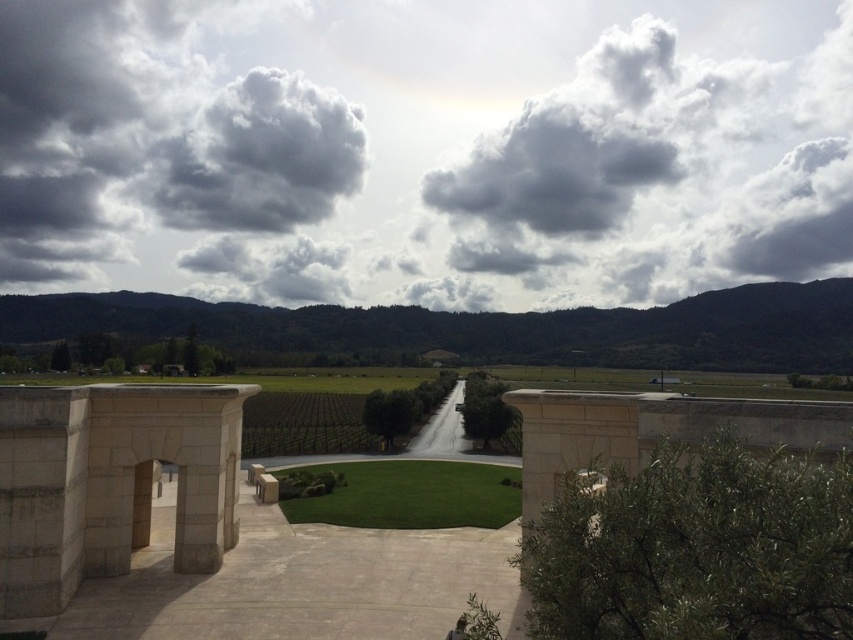
From the picture: Does cloudy sky at upper center appear under green artificial turf at center?

Incorrect, cloudy sky at upper center is not positioned below green artificial turf at center.

Can you confirm if cloudy sky at upper center is bigger than green artificial turf at center?

Yes, cloudy sky at upper center is bigger than green artificial turf at center.

Identify the location of cloudy sky at upper center. This screenshot has width=853, height=640. (422, 148).

Between cloudy sky at upper center and dark gray fluffy cloud at upper left, which one appears on the left side from the viewer's perspective?

From the viewer's perspective, dark gray fluffy cloud at upper left appears more on the left side.

At what (x,y) coordinates should I click in order to perform the action: click on cloudy sky at upper center. Please return your answer as a coordinate pair (x, y). This screenshot has width=853, height=640. Looking at the image, I should click on (422, 148).

Who is more distant from viewer, (70, 212) or (265, 129)?

Point (70, 212)

You are a GUI agent. You are given a task and a screenshot of the screen. Output one action in this format:
    pyautogui.click(x=<x>, y=<y>)
    Task: Click on the cloudy sky at upper center
    
    Given the screenshot: What is the action you would take?
    pyautogui.click(x=422, y=148)

Is dark gray fluffy cloud at upper left smaller than green artificial turf at center?

No.

Is point (325, 154) positioned in front of point (462, 499)?

No, it is behind (462, 499).

This screenshot has width=853, height=640. I want to click on dark gray fluffy cloud at upper left, so click(260, 157).